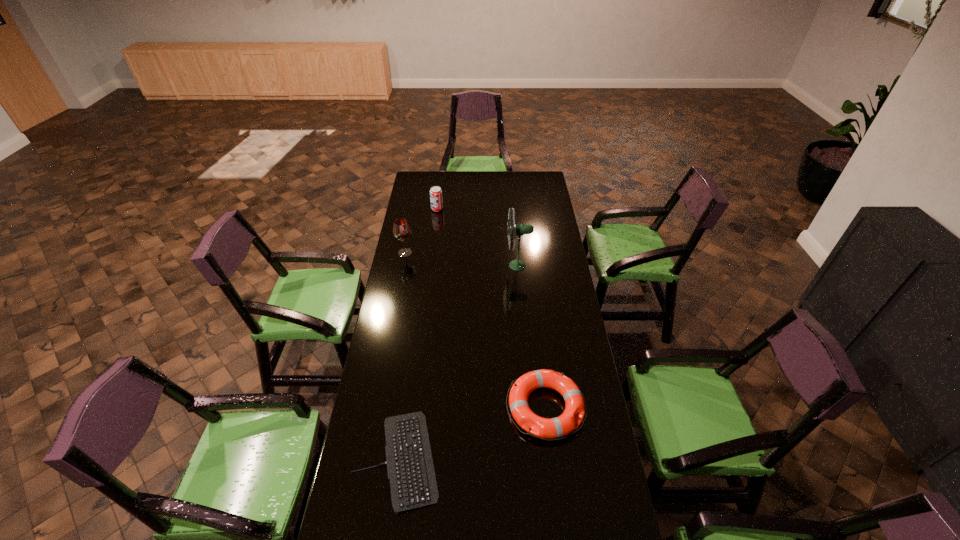
The image size is (960, 540). I want to click on object that ranks as the third closest to the computer keyboard, so click(x=401, y=230).

Where is `the closest object to the soda can`? The width and height of the screenshot is (960, 540). the closest object to the soda can is located at coordinates (401, 230).

The width and height of the screenshot is (960, 540). Identify the location of free region that satisfies the following two spatial constraints: 1. on the front side of the life buoy; 2. on the left side of the soda can. (413, 408).

The height and width of the screenshot is (540, 960). Find the location of `free location that satisfies the following two spatial constraints: 1. on the front-facing side of the tallest object; 2. on the back side of the second shortest object`. free location that satisfies the following two spatial constraints: 1. on the front-facing side of the tallest object; 2. on the back side of the second shortest object is located at coordinates (531, 408).

Find the location of a particular element. This screenshot has height=540, width=960. vacant area that satisfies the following two spatial constraints: 1. on the front-facing side of the second shortest object; 2. on the left side of the fan is located at coordinates (531, 408).